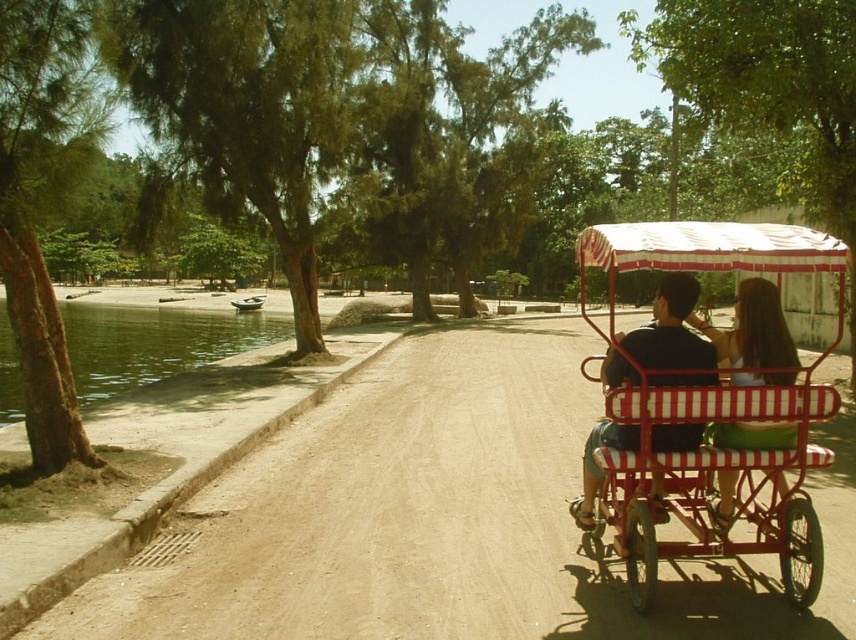
Can you confirm if clear water at lower left is positioned above matte white dress at center?

Yes.

Can you confirm if clear water at lower left is smaller than matte white dress at center?

No.

Is point (3, 362) behind point (747, 284)?

Yes, point (3, 362) is farther from viewer.

The width and height of the screenshot is (856, 640). In order to click on clear water at lower left in this screenshot , I will do `click(153, 342)`.

Does red striped cart at right appear on the left side of clear water at lower left?

In fact, red striped cart at right is to the right of clear water at lower left.

Does red striped cart at right appear on the right side of clear water at lower left?

Indeed, red striped cart at right is positioned on the right side of clear water at lower left.

The height and width of the screenshot is (640, 856). What do you see at coordinates (704, 410) in the screenshot? I see `red striped cart at right` at bounding box center [704, 410].

Locate an element on the screen. red striped cart at right is located at coordinates (704, 410).

Does brown dirt track at center appear over red striped cart at right?

No.

Is point (526, 624) positioned behind point (635, 516)?

No, (526, 624) is in front of (635, 516).

Where is `brown dirt track at center`? This screenshot has width=856, height=640. brown dirt track at center is located at coordinates pyautogui.click(x=444, y=520).